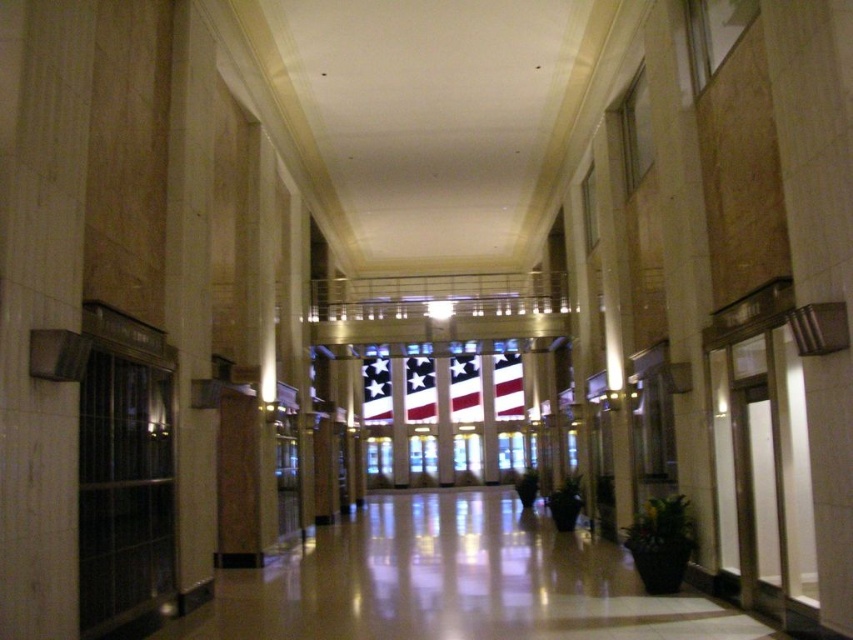
Can you confirm if white glossy floor at center is positioned to the left of white fabric flag at center?

Yes, white glossy floor at center is to the left of white fabric flag at center.

You are a GUI agent. You are given a task and a screenshot of the screen. Output one action in this format:
    pyautogui.click(x=<x>, y=<y>)
    Task: Click on the white glossy floor at center
    This screenshot has height=640, width=853.
    Given the screenshot: What is the action you would take?
    pyautogui.click(x=454, y=582)

In order to click on white glossy floor at center in this screenshot , I will do `click(454, 582)`.